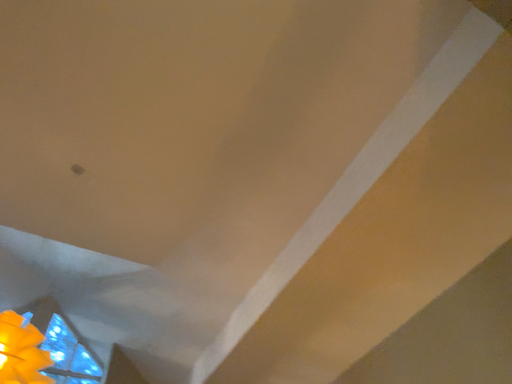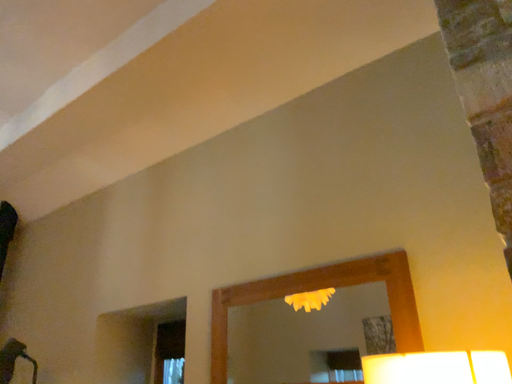
Question: How did the camera likely rotate when shooting the video?

Choices:
 (A) rotated upward
 (B) rotated downward

Answer: (B)